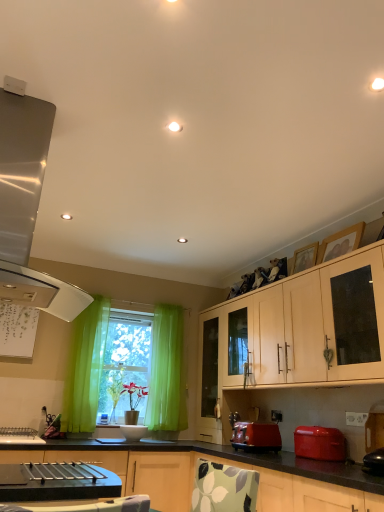
Question: From a real-world perspective, is wooden picture frame at upper right, the second picture frame when ordered from front to back, over wooden picture frame at upper right, the second picture frame when ordered from back to front?

Choices:
 (A) no
 (B) yes

Answer: (B)

Question: Is wooden picture frame at upper right, which is the 1th picture frame from back to front, not within wooden picture frame at upper right, the second picture frame when ordered from back to front?

Choices:
 (A) no
 (B) yes

Answer: (B)

Question: Considering the relative sizes of wooden picture frame at upper right, which is the 1th picture frame from back to front, and wooden picture frame at upper right, the 1th picture frame positioned from the front, in the image provided, is wooden picture frame at upper right, which is the 1th picture frame from back to front, thinner than wooden picture frame at upper right, the 1th picture frame positioned from the front,?

Choices:
 (A) yes
 (B) no

Answer: (A)

Question: Is wooden picture frame at upper right, which is the 1th picture frame from back to front, oriented away from wooden picture frame at upper right, the 1th picture frame positioned from the front?

Choices:
 (A) no
 (B) yes

Answer: (A)

Question: Can you confirm if wooden picture frame at upper right, which is the 1th picture frame from back to front, is smaller than wooden picture frame at upper right, the 1th picture frame positioned from the front?

Choices:
 (A) yes
 (B) no

Answer: (A)

Question: From a real-world perspective, is wooden picture frame at upper right, the second picture frame when ordered from front to back, below wooden picture frame at upper right, the second picture frame when ordered from back to front?

Choices:
 (A) yes
 (B) no

Answer: (B)

Question: Is matte white cabinet at center, which ranks as the first cabinetry in bottom-to-top order, inside white plastic power outlet at lower right?

Choices:
 (A) no
 (B) yes

Answer: (A)

Question: Can we say white plastic power outlet at lower right lies outside matte white cabinet at center, which ranks as the first cabinetry in bottom-to-top order?

Choices:
 (A) no
 (B) yes

Answer: (B)

Question: Is white plastic power outlet at lower right not near matte white cabinet at center, placed as the 2th cabinetry when sorted from top to bottom?

Choices:
 (A) no
 (B) yes

Answer: (A)

Question: Is white plastic power outlet at lower right to the right of matte white cabinet at center, which ranks as the first cabinetry in bottom-to-top order, from the viewer's perspective?

Choices:
 (A) no
 (B) yes

Answer: (B)

Question: From a real-world perspective, is white plastic power outlet at lower right located beneath matte white cabinet at center, placed as the 2th cabinetry when sorted from top to bottom?

Choices:
 (A) yes
 (B) no

Answer: (B)

Question: Does white plastic power outlet at lower right have a smaller size compared to matte white cabinet at center, which ranks as the first cabinetry in bottom-to-top order?

Choices:
 (A) yes
 (B) no

Answer: (A)

Question: Is matte red toaster at lower center taller than green sheer curtain at window?

Choices:
 (A) yes
 (B) no

Answer: (B)